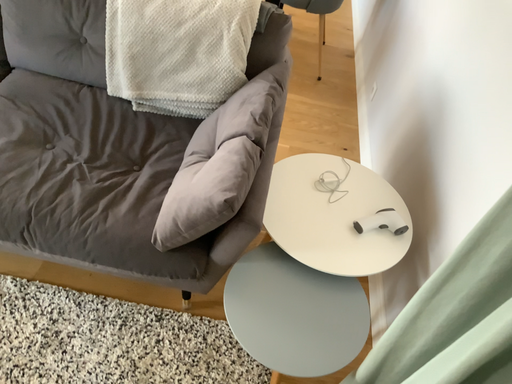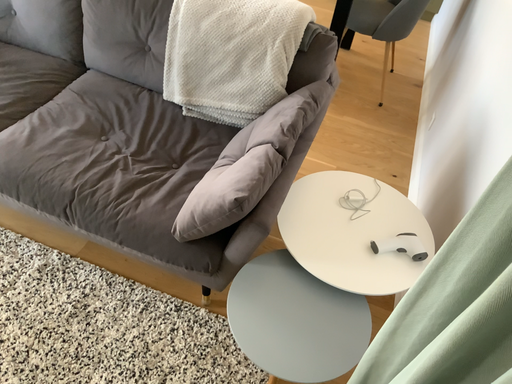
Question: Which way did the camera rotate in the video?

Choices:
 (A) rotated left
 (B) rotated right

Answer: (A)